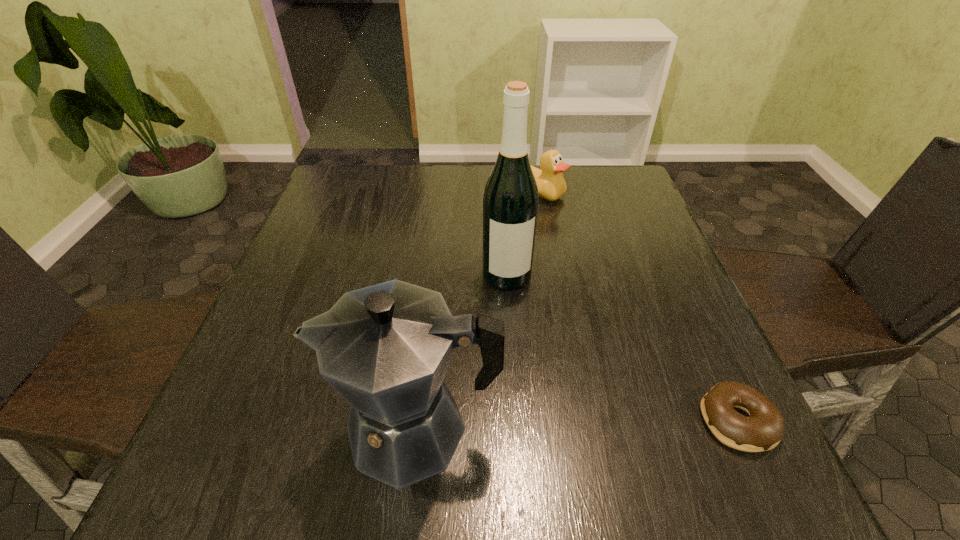
Where is `free space located on the left of the doughnut`? This screenshot has height=540, width=960. free space located on the left of the doughnut is located at coordinates (629, 421).

At what (x,y) coordinates should I click in order to perform the action: click on vacant space situated on the label of the wine bottle. Please return your answer as a coordinate pair (x, y). Looking at the image, I should click on (534, 415).

Where is `vacant area situated on the label of the wine bottle`? vacant area situated on the label of the wine bottle is located at coordinates (515, 313).

Where is `free space located 0.100m on the label of the wine bottle`? This screenshot has height=540, width=960. free space located 0.100m on the label of the wine bottle is located at coordinates (517, 328).

Where is `vacant area situated at the beak of the duck`? This screenshot has width=960, height=540. vacant area situated at the beak of the duck is located at coordinates point(569,293).

I want to click on free location located 0.170m at the beak of the duck, so click(x=555, y=246).

Where is `vacant space located 0.400m at the beak of the duck`? This screenshot has height=540, width=960. vacant space located 0.400m at the beak of the duck is located at coordinates (577, 317).

The image size is (960, 540). Find the location of `object present at the far edge`. object present at the far edge is located at coordinates (551, 184).

You are a GUI agent. You are given a task and a screenshot of the screen. Output one action in this format:
    pyautogui.click(x=<x>, y=<y>)
    Task: Click on the coffeepot located at the near edge
    This screenshot has height=540, width=960.
    Given the screenshot: What is the action you would take?
    pyautogui.click(x=385, y=349)

Locate an element on the screen. The image size is (960, 540). doughnut that is at the near edge is located at coordinates (763, 429).